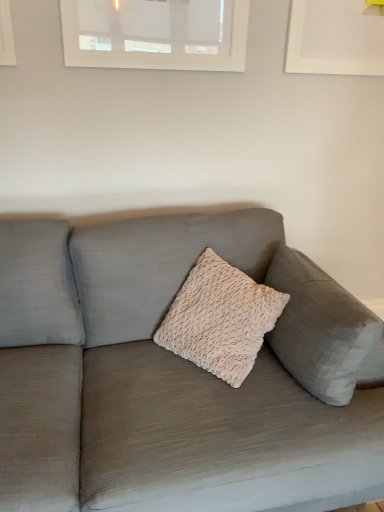
This screenshot has height=512, width=384. What do you see at coordinates (157, 380) in the screenshot? I see `matte gray couch at center` at bounding box center [157, 380].

Where is `matte gray couch at center`? This screenshot has height=512, width=384. matte gray couch at center is located at coordinates (157, 380).

Locate an element on the screen. This screenshot has height=512, width=384. white textured window at upper center is located at coordinates 156,34.

Image resolution: width=384 pixels, height=512 pixels. What do you see at coordinates (156, 34) in the screenshot? I see `white textured window at upper center` at bounding box center [156, 34].

At what (x,y) coordinates should I click in order to perform the action: click on matte gray couch at center. Please return your answer as a coordinate pair (x, y). Looking at the image, I should click on (157, 380).

Which object is positioned more to the left, matte gray couch at center or white textured window at upper center?

From the viewer's perspective, white textured window at upper center appears more on the left side.

Does matte gray couch at center lie behind white textured window at upper center?

No, the depth of matte gray couch at center is less than that of white textured window at upper center.

Is point (216, 488) closer or farther from the camera than point (102, 32)?

Clearly, point (216, 488) is closer to the camera than point (102, 32).

From the image's perspective, does matte gray couch at center appear higher than white textured window at upper center?

Incorrect, from the image's perspective, matte gray couch at center is lower than white textured window at upper center.

From a real-world perspective, which is physically below, matte gray couch at center or white textured window at upper center?

matte gray couch at center.

Between matte gray couch at center and white textured window at upper center, which one has smaller width?

Thinner between the two is white textured window at upper center.

Does matte gray couch at center have a greater height compared to white textured window at upper center?

Yes.

Considering the relative sizes of matte gray couch at center and white textured window at upper center in the image provided, is matte gray couch at center bigger than white textured window at upper center?

Yes.

Do you think matte gray couch at center is within white textured window at upper center, or outside of it?

matte gray couch at center is not enclosed by white textured window at upper center.

From the picture: Is matte gray couch at center not near white textured window at upper center?

That's not correct — matte gray couch at center is a little close to white textured window at upper center.

Is matte gray couch at center looking in the opposite direction of white textured window at upper center?

No, matte gray couch at center's orientation is not away from white textured window at upper center.

Can you tell me how much matte gray couch at center and white textured window at upper center differ in facing direction?

There is a 0.33-degree angle between the facing directions of matte gray couch at center and white textured window at upper center.

The height and width of the screenshot is (512, 384). Identify the location of studio couch below the white textured window at upper center (from a real-world perspective). (157, 380).

Considering the relative positions of white textured window at upper center and matte gray couch at center in the image provided, is white textured window at upper center to the left or to the right of matte gray couch at center?

From the image, it's evident that white textured window at upper center is to the left of matte gray couch at center.

In the image, is white textured window at upper center positioned in front of or behind matte gray couch at center?

white textured window at upper center is behind matte gray couch at center.

Which is less distant, (247, 10) or (4, 399)?

Point (247, 10) appears to be farther away from the viewer than point (4, 399).

From the image's perspective, is white textured window at upper center above matte gray couch at center?

Yes.

From a real-world perspective, is white textured window at upper center on matte gray couch at center?

Indeed, from a real-world perspective, white textured window at upper center stands above matte gray couch at center.

Considering the sizes of white textured window at upper center and matte gray couch at center in the image, is white textured window at upper center wider or thinner than matte gray couch at center?

Clearly, white textured window at upper center has less width compared to matte gray couch at center.

Which of these two, white textured window at upper center or matte gray couch at center, stands taller?

matte gray couch at center.

Which of these two, white textured window at upper center or matte gray couch at center, is smaller?

With smaller size is white textured window at upper center.

Is white textured window at upper center surrounding matte gray couch at center?

Actually, matte gray couch at center is outside white textured window at upper center.

Are white textured window at upper center and matte gray couch at center beside each other?

Result: No, white textured window at upper center is not in contact with matte gray couch at center.

Does white textured window at upper center turn towards matte gray couch at center?

No, white textured window at upper center does not turn towards matte gray couch at center.

In order to click on window on the left of matte gray couch at center in this screenshot , I will do `click(156, 34)`.

Locate an element on the screen. The height and width of the screenshot is (512, 384). window behind the matte gray couch at center is located at coordinates (156, 34).

The height and width of the screenshot is (512, 384). In order to click on studio couch below the white textured window at upper center (from the image's perspective) in this screenshot , I will do `click(157, 380)`.